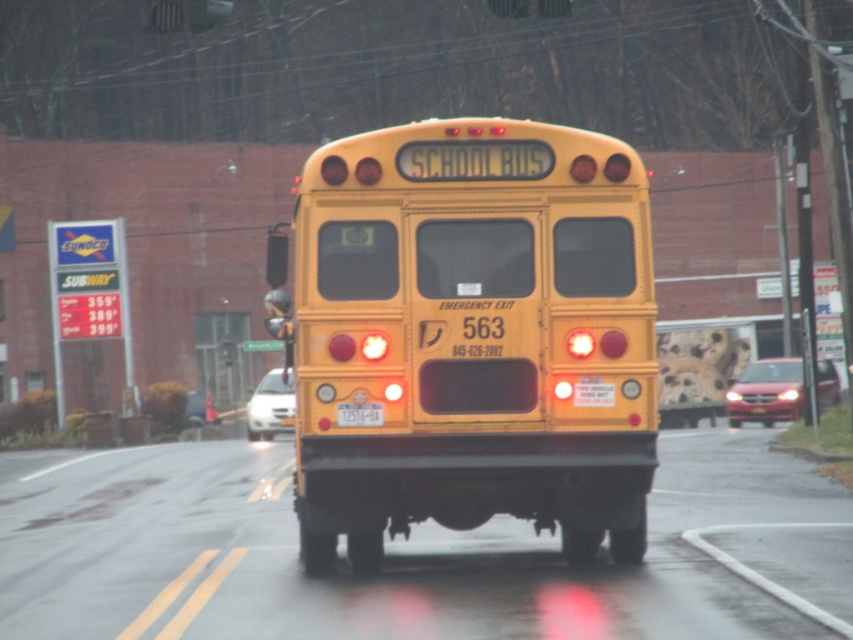
You are standing in front of the yellow school bus looking at its rear. There are two points marked on the bus. One is at coordinate point [550,513] and the other at point [354,406]. Which point is closer to you?

Point [354,406] is closer to you because it is less further to the camera than point [550,513].